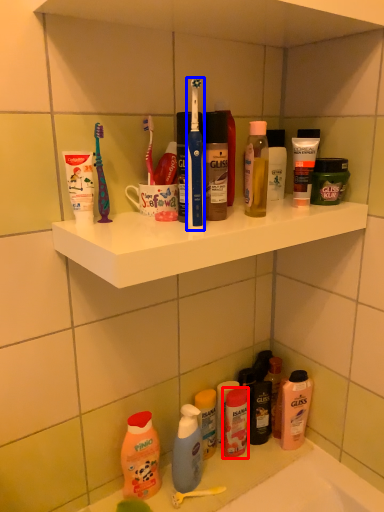
Question: Among these objects, which one is nearest to the camera, toiletry (highlighted by a red box) or toothbrush (highlighted by a blue box)?

Choices:
 (A) toiletry
 (B) toothbrush

Answer: (B)